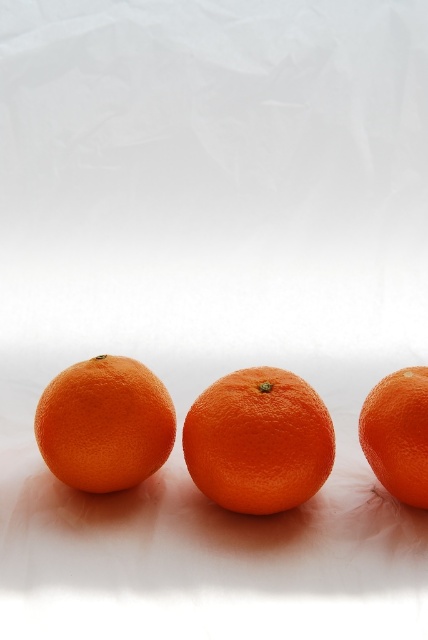
Is orangesmoothorange at center wider than orangesmoothorange at right?

Yes, orangesmoothorange at center is wider than orangesmoothorange at right.

Who is positioned more to the left, orangesmoothorange at center or orangesmoothorange at right?

orangesmoothorange at center is more to the left.

Describe the element at coordinates (258, 440) in the screenshot. I see `orangesmoothorange at center` at that location.

Find the location of a particular element. orangesmoothorange at center is located at coordinates (258, 440).

Is orangesmoothorange at center bigger than orange matte tangerine at center?

Indeed, orangesmoothorange at center has a larger size compared to orange matte tangerine at center.

Who is more distant from viewer, (318, 397) or (98, 445)?

Point (318, 397)

Find the location of `orangesmoothorange at center`. orangesmoothorange at center is located at coordinates (258, 440).

Is orange matte tangerine at center positioned in front of orangesmoothorange at right?

No, orange matte tangerine at center is further to the viewer.

Where is `orange matte tangerine at center`? orange matte tangerine at center is located at coordinates (104, 424).